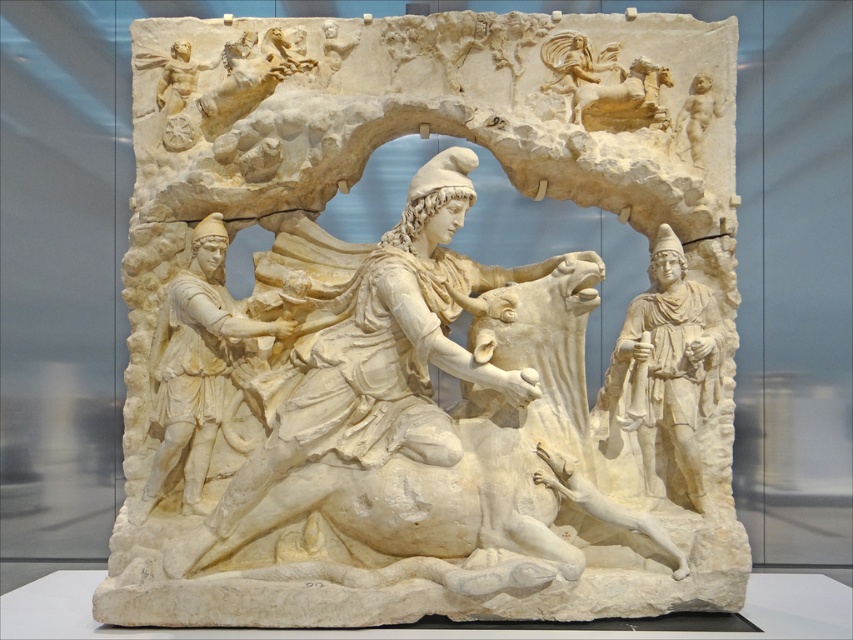
Based on the scene description, if you were standing in front of the relief sculpture, which object would you see lower down, the white marble figure at center or the white marble warrior at left?

The white marble figure at center is located below the white marble warrior at left, so you would see the white marble figure at center lower down.

Based on the scene description, if you were to compare the sizes of the white marble figure at center and the smooth beige cherub at upper right, which one would you estimate to be bigger?

The white marble figure at center is larger in size than the smooth beige cherub at upper right according to the description.